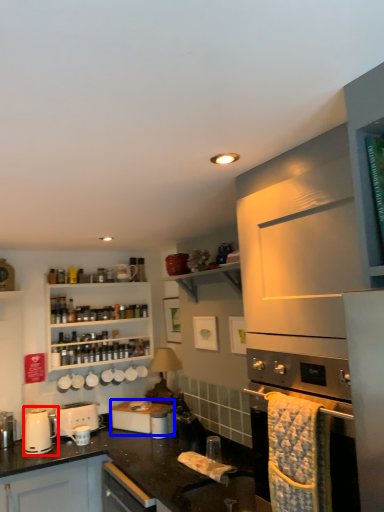
Question: Which of the following is the closest to the observer, kitchen appliance (highlighted by a red box) or appliance (highlighted by a blue box)?

Choices:
 (A) kitchen appliance
 (B) appliance

Answer: (A)